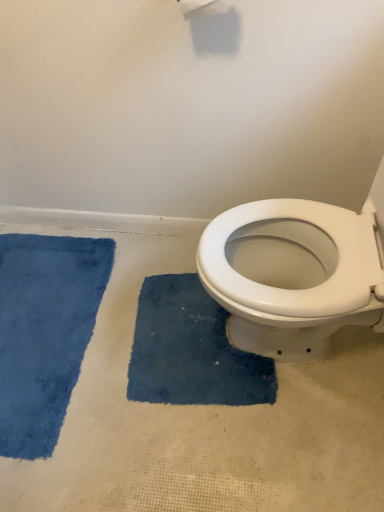
In order to click on empty space that is ontop of blue plush bath mat at center, which appears as the 2th bath mat when viewed from the left (from a real-world perspective) in this screenshot , I will do [x=190, y=337].